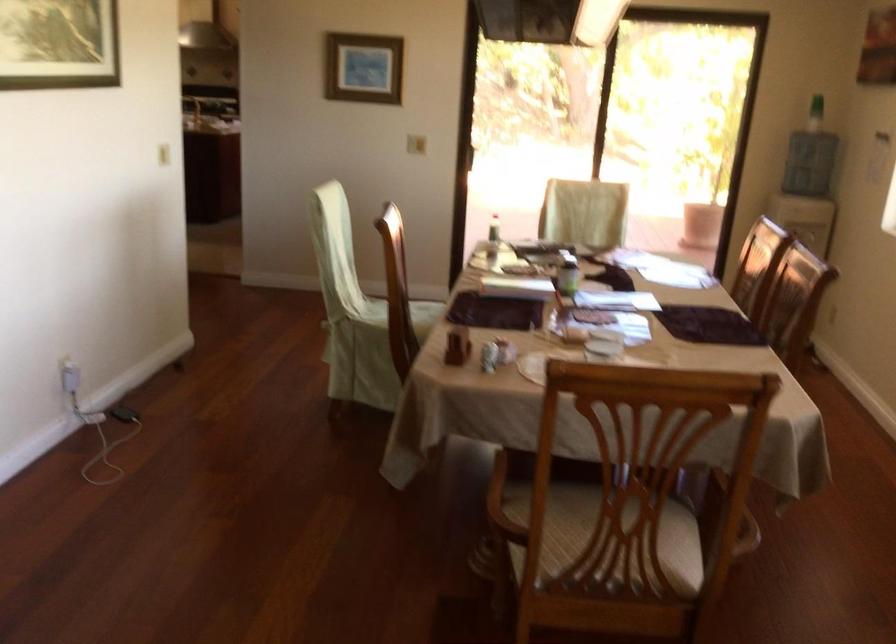
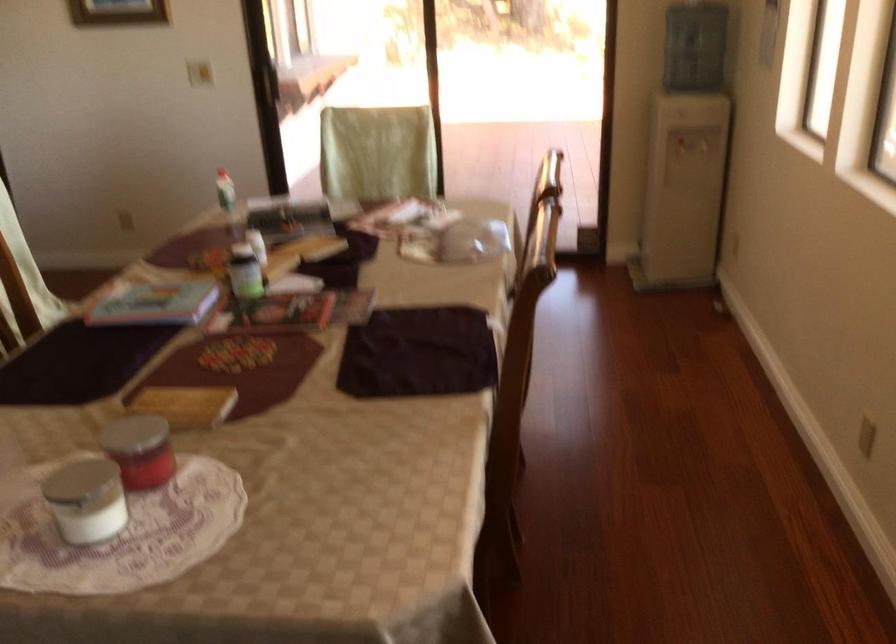
Where in the second image is the point corresponding to (x=574, y=270) from the first image?

(245, 272)